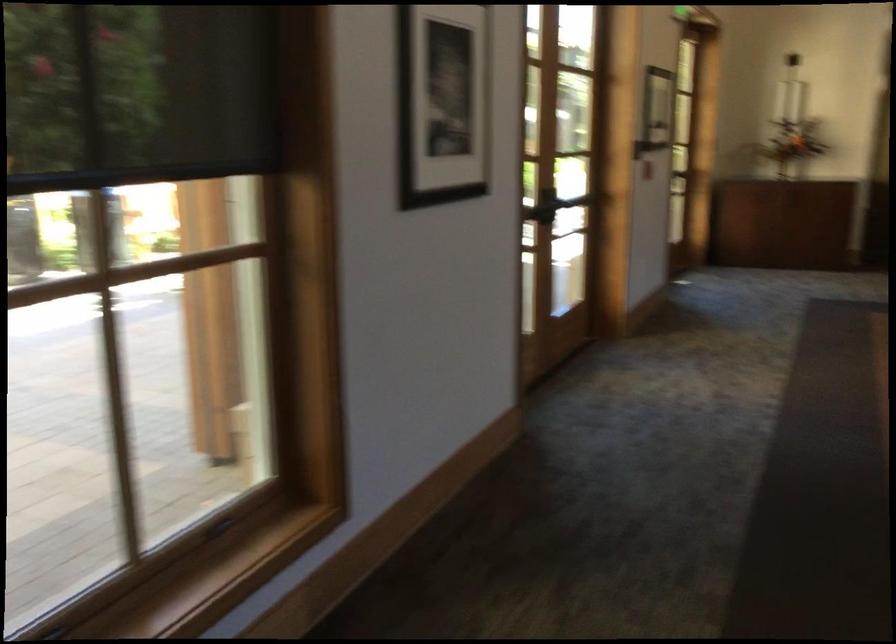
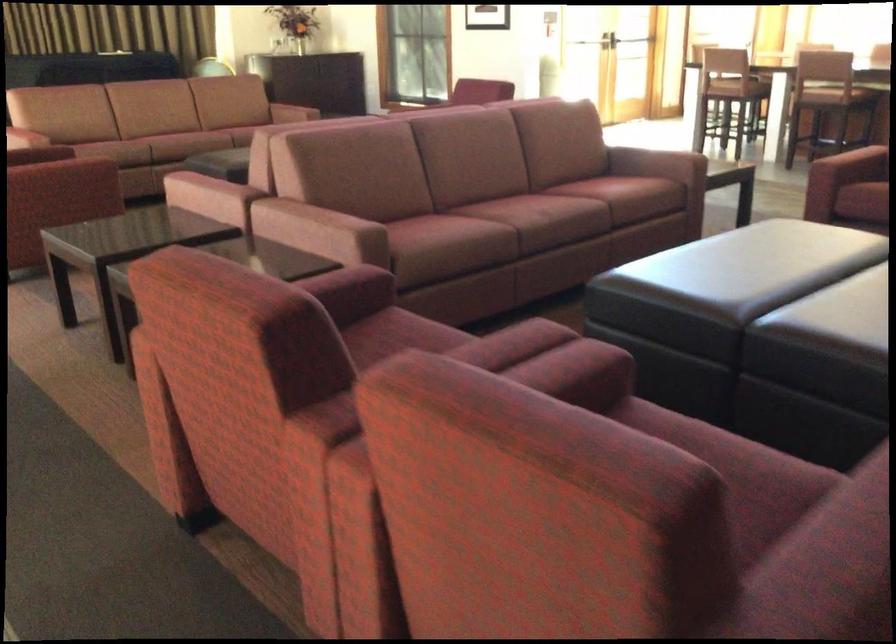
Question: The images are taken continuously from a first-person perspective. In which direction is your viewpoint rotating?

Choices:
 (A) Left
 (B) Right
 (C) Up
 (D) Down

Answer: (B)